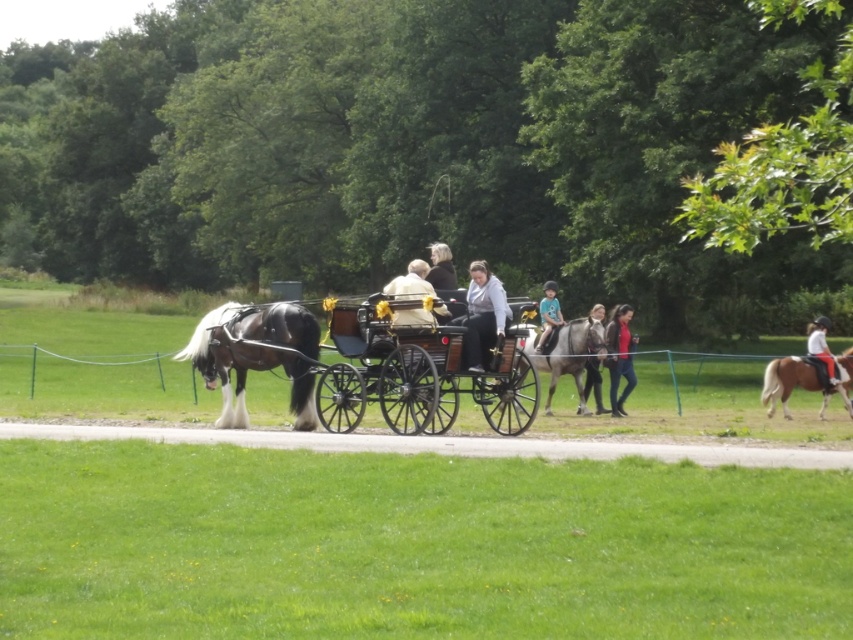
You are a photographer standing on the paved pathway in the park. You want to take a photo of the brown glossy horse at right and the matte red shirt at center. Which object will appear taller in the photo?

The brown glossy horse at right will appear taller in the photo because it has a greater height compared to the matte red shirt at center.

You are standing at the bottom left corner of the image. Looking towards the center, where would you find the matte red shirt at center?

The matte red shirt at center is located at the 2D coordinates point (619, 356), which is near the center of the image.

You are standing on the paved pathway in the park and see the dark brown leather jacket at center and the teal jersey at center in the carriage. Which piece of clothing is positioned to the left when facing the carriage?

The dark brown leather jacket at center is to the left of the teal jersey at center when facing the carriage.